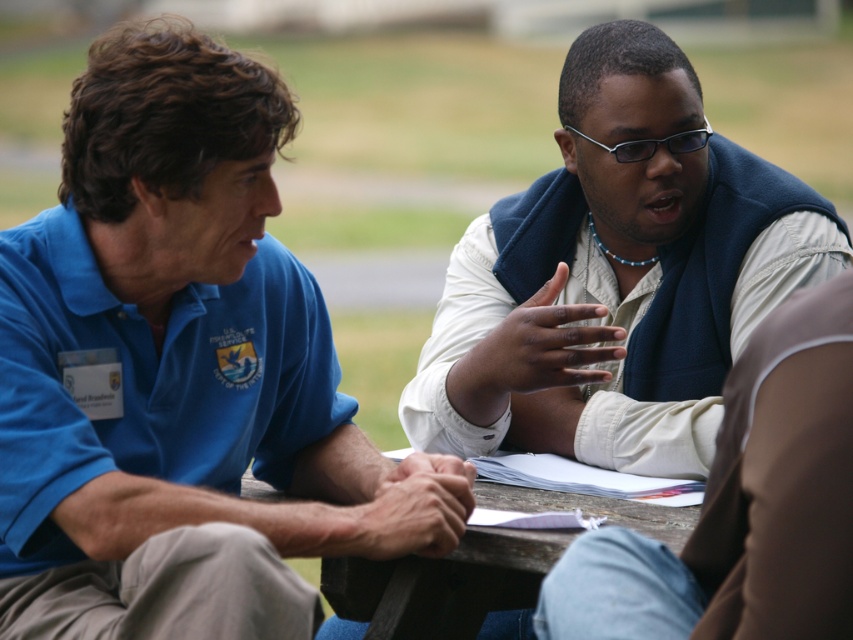
Is blue cotton shirt at left closer to camera compared to light beige vest at center?

Yes, it is.

Identify the location of blue cotton shirt at left. (180, 372).

Can you confirm if blue cotton shirt at left is positioned below wooden table at center?

No.

Does point (263, 250) come farther from viewer compared to point (323, 577)?

No, it is in front of (323, 577).

In order to click on blue cotton shirt at left in this screenshot , I will do `click(180, 372)`.

Does light beige vest at center have a greater height compared to wooden table at center?

Indeed, light beige vest at center has a greater height compared to wooden table at center.

Which is above, light beige vest at center or wooden table at center?

light beige vest at center is higher up.

Is point (608, 262) farther from viewer compared to point (351, 637)?

Yes, it is behind point (351, 637).

The image size is (853, 640). In order to click on light beige vest at center in this screenshot , I will do `click(618, 275)`.